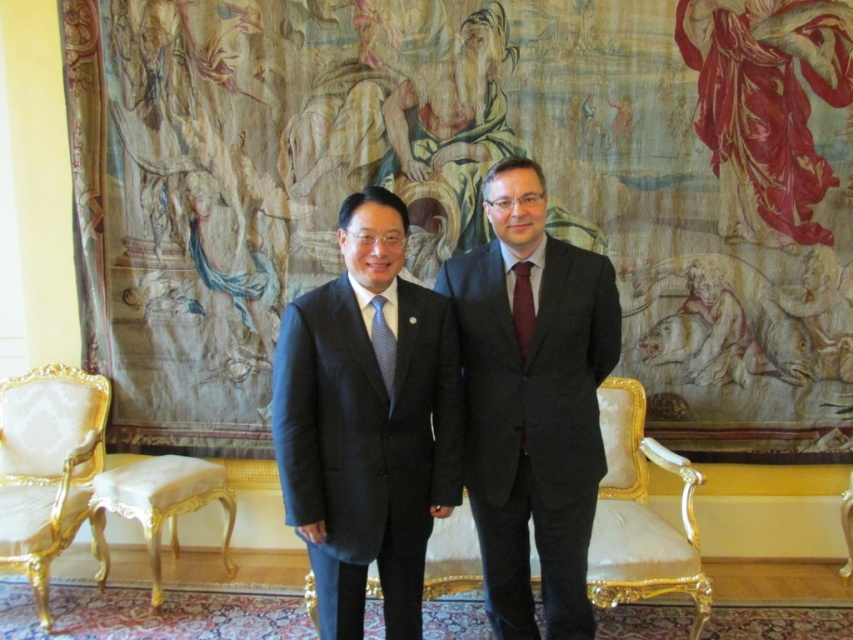
Is silky fabric tapestry at center wider than gold damask armchair at left?

Indeed, silky fabric tapestry at center has a greater width compared to gold damask armchair at left.

Is silky fabric tapestry at center shorter than gold damask armchair at left?

No.

Which is behind, point (817, 332) or point (38, 468)?

The point (817, 332) is more distant.

The width and height of the screenshot is (853, 640). I want to click on silky fabric tapestry at center, so click(468, 189).

Does dark gray wool suit at center appear on the left side of blue dotted tie at center?

Incorrect, dark gray wool suit at center is not on the left side of blue dotted tie at center.

Locate an element on the screen. The width and height of the screenshot is (853, 640). dark gray wool suit at center is located at coordinates (532, 420).

Identify the location of dark gray wool suit at center. The height and width of the screenshot is (640, 853). (532, 420).

Does dark blue wool suit at center appear on the right side of gold damask armchair at left?

Yes, dark blue wool suit at center is to the right of gold damask armchair at left.

Consider the image. Who is higher up, dark blue wool suit at center or gold damask armchair at left?

Positioned higher is dark blue wool suit at center.

What do you see at coordinates (366, 445) in the screenshot? I see `dark blue wool suit at center` at bounding box center [366, 445].

In order to click on dark blue wool suit at center in this screenshot , I will do `click(366, 445)`.